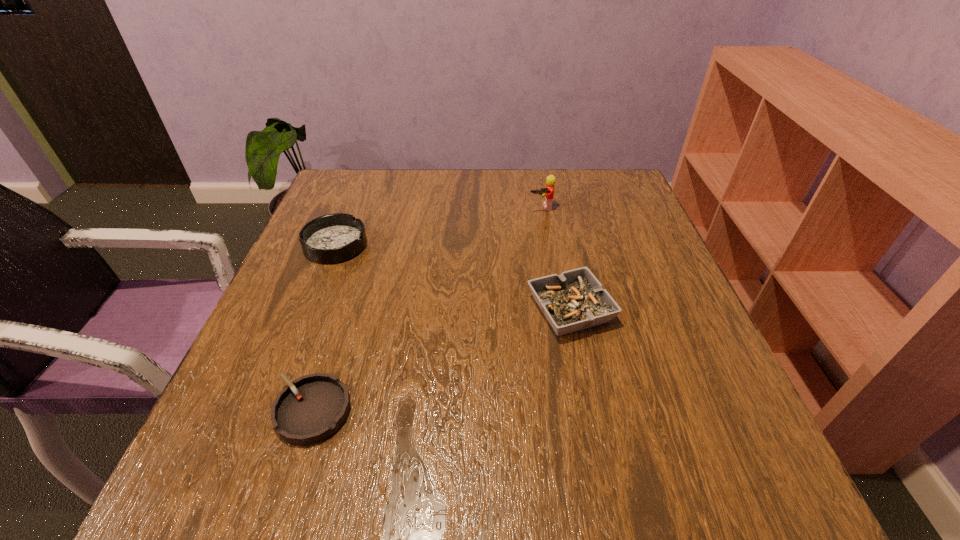
Find the location of `free location located on the back of the shortest object`. free location located on the back of the shortest object is located at coordinates (350, 289).

Identify the location of object positioned at the far edge. The height and width of the screenshot is (540, 960). (547, 192).

Image resolution: width=960 pixels, height=540 pixels. I want to click on object positioned at the right edge, so click(575, 300).

Identify the location of vacant space at the far edge of the desktop. The image size is (960, 540). (532, 212).

Where is `vacant space at the near edge of the desktop`? The width and height of the screenshot is (960, 540). vacant space at the near edge of the desktop is located at coordinates (523, 486).

Identify the location of vacant space at the left edge of the desktop. The width and height of the screenshot is (960, 540). (309, 307).

Find the location of a particular element. This screenshot has width=960, height=540. vacant region at the right edge is located at coordinates (621, 350).

At what (x,y) coordinates should I click in order to perform the action: click on vacant area at the far left corner of the desktop. Please return your answer as a coordinate pair (x, y). Image resolution: width=960 pixels, height=540 pixels. Looking at the image, I should click on (372, 181).

Identify the location of free space at the far right corner of the desktop. The width and height of the screenshot is (960, 540). (593, 178).

The width and height of the screenshot is (960, 540). In order to click on free location at the near right corner of the desktop in this screenshot , I will do `click(653, 451)`.